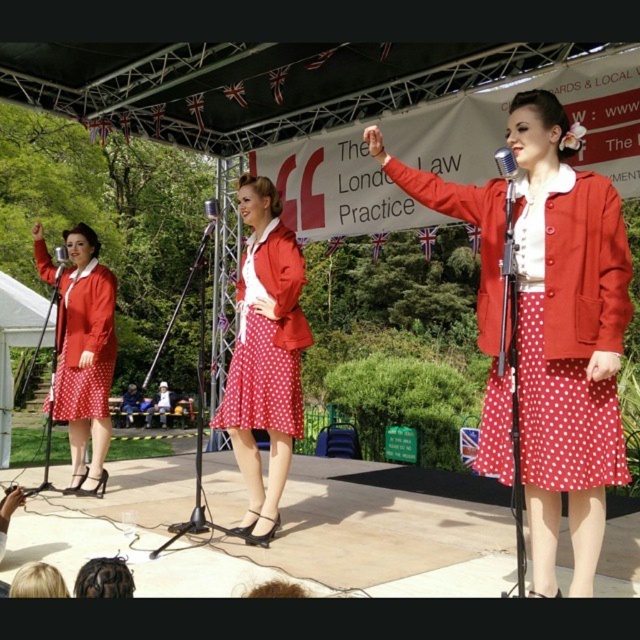
Question: Which point is farther to the camera?

Choices:
 (A) matte red skirt at left
 (B) polka dot fabric skirt at center
 (C) matte red skirt at center
 (D) metallic silver microphone at upper center

Answer: (A)

Question: Which point is closer to the camera?

Choices:
 (A) polka dot fabric dress at center
 (B) matte red skirt at left
 (C) polka dot fabric skirt at center

Answer: (A)

Question: Can you confirm if matte red skirt at left is positioned below metallic silver microphone at upper center?

Choices:
 (A) no
 (B) yes

Answer: (B)

Question: Can you confirm if polka dot fabric skirt at center is thinner than metallic silver microphone at upper center?

Choices:
 (A) no
 (B) yes

Answer: (A)

Question: Can you confirm if polka dot fabric skirt at center is smaller than matte red skirt at left?

Choices:
 (A) yes
 (B) no

Answer: (A)

Question: Considering the real-world distances, which object is closest to the matte red skirt at left?

Choices:
 (A) matte red skirt at center
 (B) polka dot fabric skirt at center
 (C) metallic silver microphone at upper center
 (D) matte red jacket at center

Answer: (B)